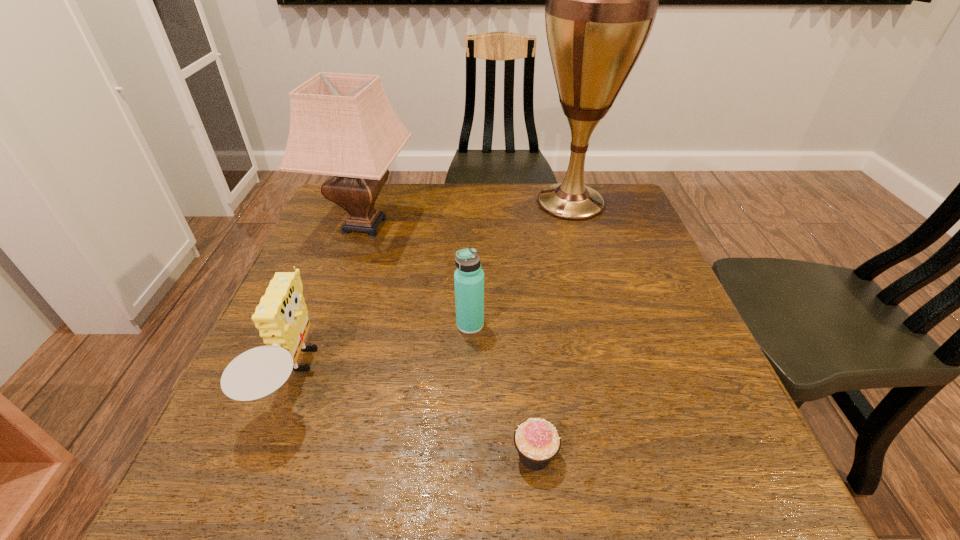
The width and height of the screenshot is (960, 540). What are the coordinates of `free location that satisfies the following two spatial constraints: 1. on the back side of the thermos bottle; 2. on the right side of the trophy cup` in the screenshot? It's located at (473, 202).

Where is `free space that satisfies the following two spatial constraints: 1. on the front-facing side of the shortest object; 2. on the left side of the sponge`? free space that satisfies the following two spatial constraints: 1. on the front-facing side of the shortest object; 2. on the left side of the sponge is located at coordinates (265, 455).

Locate an element on the screen. This screenshot has width=960, height=540. vacant area that satisfies the following two spatial constraints: 1. on the front side of the rightmost object; 2. on the front-facing side of the sponge is located at coordinates (621, 375).